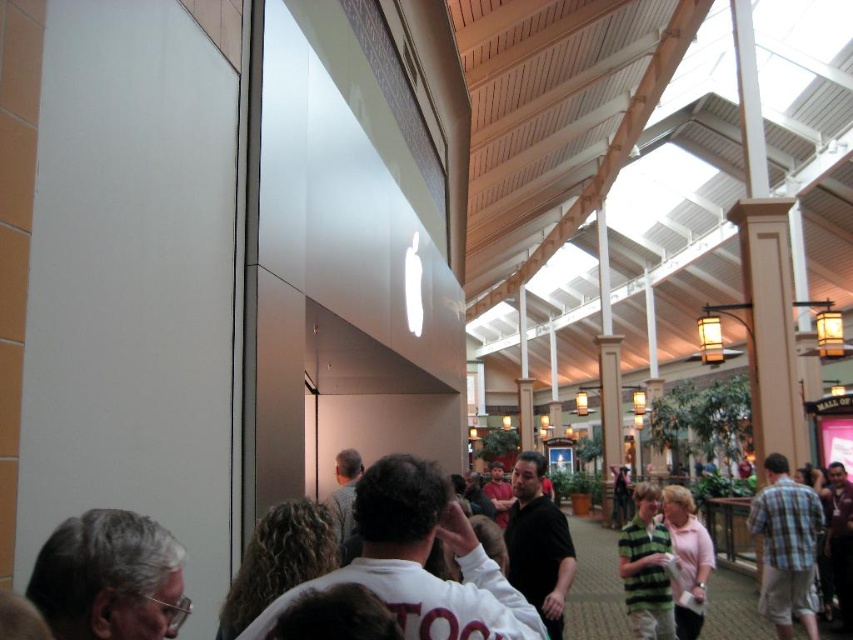
You are a photographer standing in the shopping area and want to capture a photo of the gray hair at lower left and the pink fabric shirt at center. Based on their positions, which object is located higher in the image?

The gray hair at lower left is above the pink fabric shirt at center, so it is located higher in the image.

You are a photographer trying to capture both the striped green shirt at center and the pink fabric shirt at center in a single frame. Since you want to ensure both shirts are fully visible, which shirt should you focus on to avoid cropping the wider one?

The striped green shirt at center has a lesser width compared to the pink fabric shirt at center. Therefore, you should focus on the pink fabric shirt at center to avoid cropping the wider one.